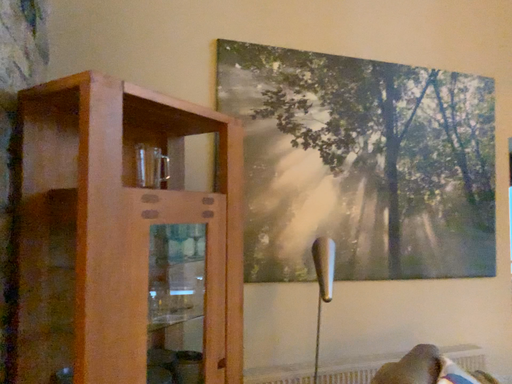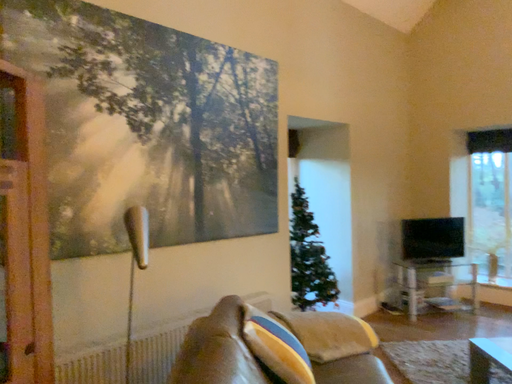
Question: How did the camera likely rotate when shooting the video?

Choices:
 (A) rotated right
 (B) rotated left

Answer: (A)